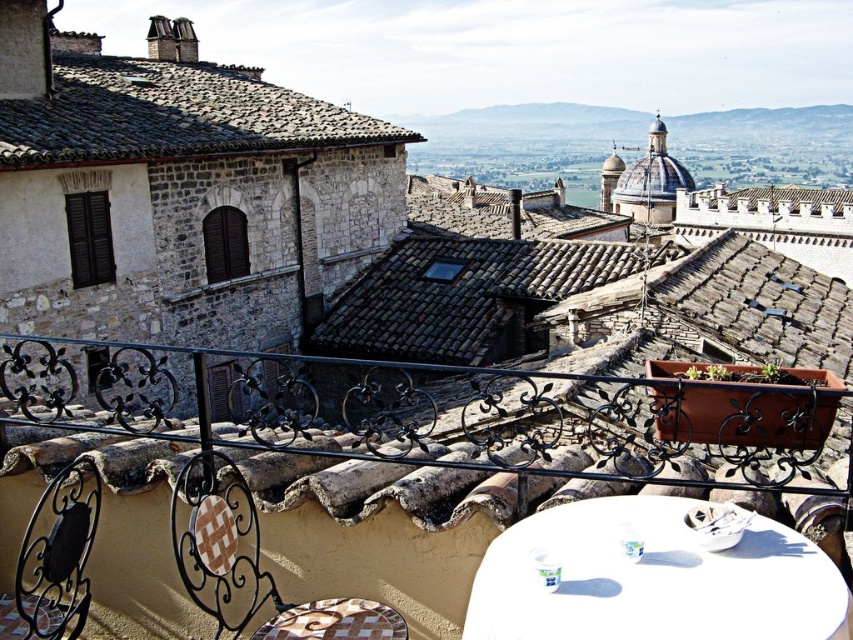
You are standing on the rooftop terrace and want to place a new potted plant on the closest object to you. Which object should you choose between the white glossy table at lower right and the brown tiled roof at upper left?

The white glossy table at lower right is closer to the viewer than the brown tiled roof at upper left, so you should place the potted plant on the white glossy table at lower right.

You are standing on the rooftop terrace and want to place a small potted plant between the black wrought iron railing at center and the brown woven chair at lower left. Which object should the plant be closer to if you want it to be near the edge of the terrace?

The plant should be placed closer to the black wrought iron railing at center since it is in front of the brown woven chair at lower left, making it closer to the edge of the terrace.